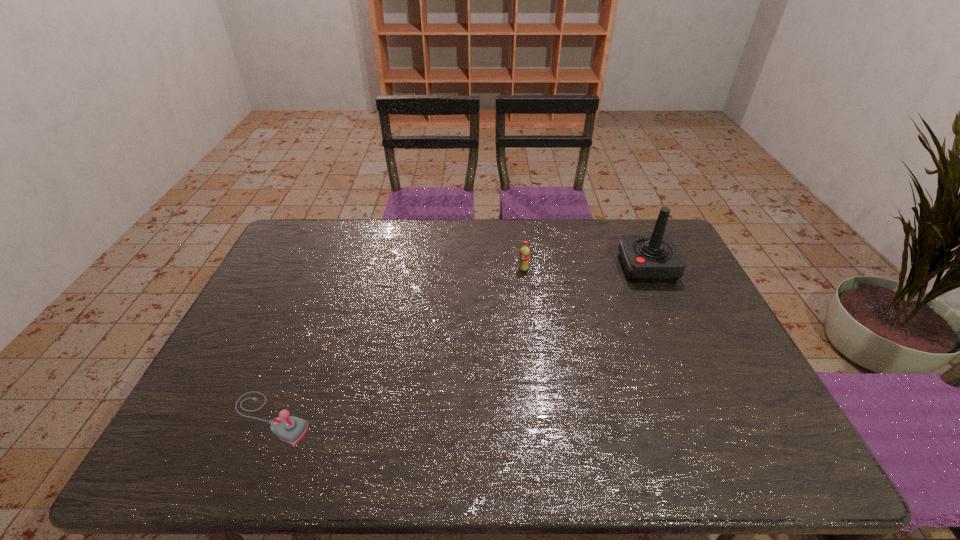
Find the location of a particular element. The height and width of the screenshot is (540, 960). vacant space located 0.200m on the back of the nearest object is located at coordinates (305, 332).

Image resolution: width=960 pixels, height=540 pixels. Find the location of `object that is at the far edge`. object that is at the far edge is located at coordinates (646, 258).

At what (x,y) coordinates should I click in order to perform the action: click on object positioned at the near edge. Please return your answer as a coordinate pair (x, y). The width and height of the screenshot is (960, 540). Looking at the image, I should click on 291,429.

You are a GUI agent. You are given a task and a screenshot of the screen. Output one action in this format:
    pyautogui.click(x=<x>, y=<y>)
    Task: Click on the object that is at the left edge
    
    Given the screenshot: What is the action you would take?
    pyautogui.click(x=291, y=429)

Where is `object present at the right edge`? This screenshot has width=960, height=540. object present at the right edge is located at coordinates point(646,258).

At what (x,y) coordinates should I click in order to perform the action: click on object located at the near left corner. Please return your answer as a coordinate pair (x, y). The image size is (960, 540). Looking at the image, I should click on (291, 429).

Find the location of `object present at the far right corner`. object present at the far right corner is located at coordinates (646, 258).

Where is `vacant space at the far edge of the desktop`? This screenshot has height=540, width=960. vacant space at the far edge of the desktop is located at coordinates (493, 231).

Where is `blank area at the near edge`? The width and height of the screenshot is (960, 540). blank area at the near edge is located at coordinates (611, 441).

This screenshot has width=960, height=540. Identify the location of vacant area at the left edge of the desktop. (274, 293).